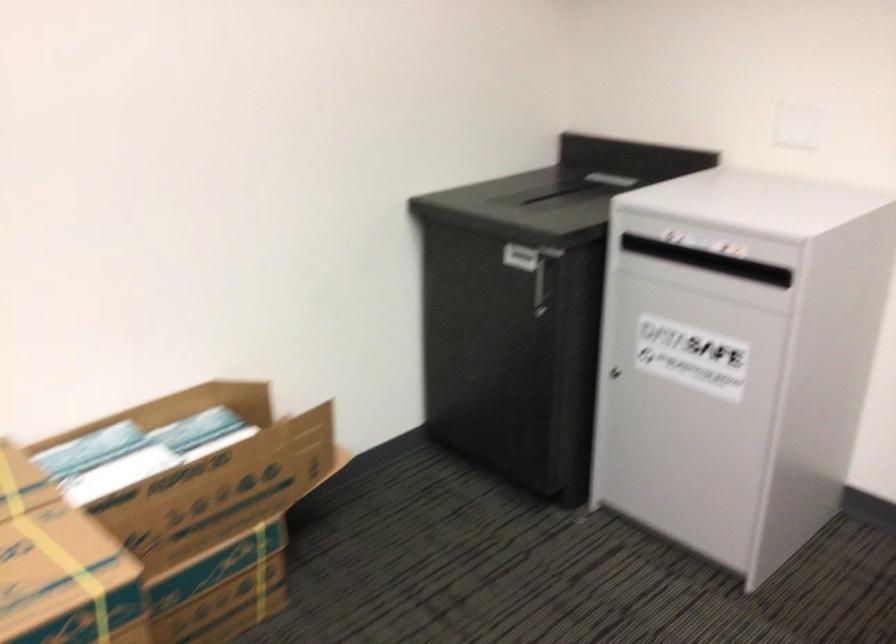
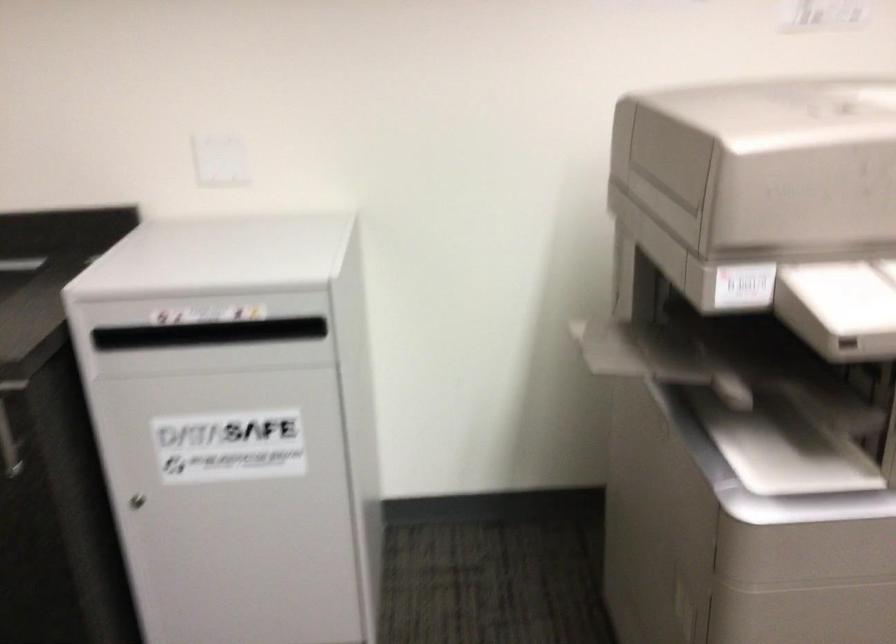
Question: Based on the continuous images, in which direction is the camera rotating? Reply with the corresponding letter.

Choices:
 (A) Left
 (B) Right
 (C) Up
 (D) Down

Answer: (B)